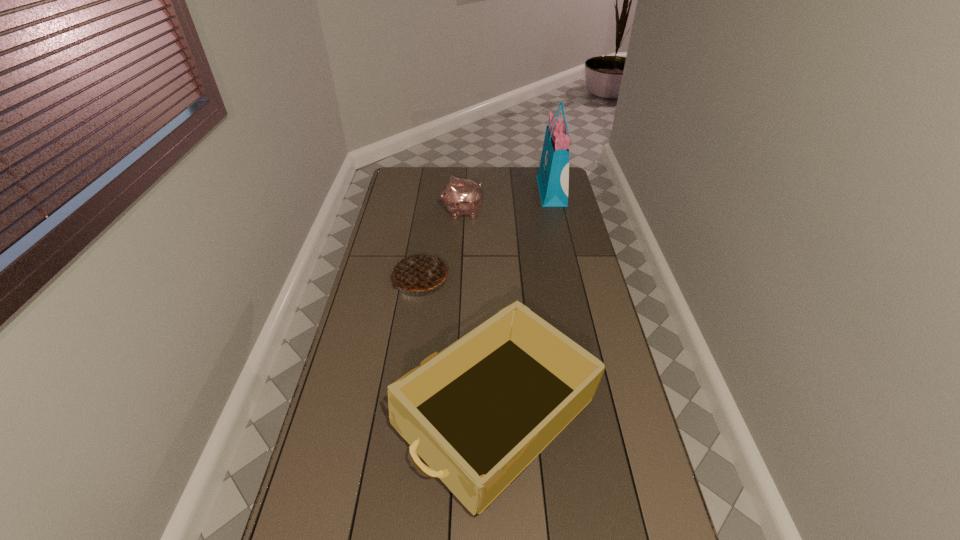
Image resolution: width=960 pixels, height=540 pixels. I want to click on shopping bag, so click(553, 175).

You are a GUI agent. You are given a task and a screenshot of the screen. Output one action in this format:
    pyautogui.click(x=<x>, y=<y>)
    Task: Click on the nearest object
    The height and width of the screenshot is (540, 960).
    Given the screenshot: What is the action you would take?
    pyautogui.click(x=478, y=413)

Locate an element on the screen. This screenshot has height=540, width=960. box is located at coordinates tap(478, 413).

Find the location of a particular element. The width and height of the screenshot is (960, 540). piggy bank is located at coordinates (461, 196).

Identify the location of the second nearest object. (420, 271).

You are a GUI agent. You are given a task and a screenshot of the screen. Output one action in this format:
    pyautogui.click(x=<x>, y=<y>)
    Task: Click on the free space located on the front of the shopping bag
    
    Given the screenshot: What is the action you would take?
    pyautogui.click(x=559, y=223)

The width and height of the screenshot is (960, 540). Identify the location of vacant space located 0.400m on the back of the nearest object. (492, 262).

At what (x,y) coordinates should I click in order to perform the action: click on vacant area situated 0.190m on the front facing side of the piggy bank. Please return your answer as a coordinate pair (x, y). This screenshot has width=960, height=540. Looking at the image, I should click on (401, 212).

The height and width of the screenshot is (540, 960). Identify the location of free space located on the front facing side of the piggy bank. (420, 212).

Image resolution: width=960 pixels, height=540 pixels. In order to click on vacant area located 0.070m on the front facing side of the piggy bank in this screenshot , I will do `click(427, 212)`.